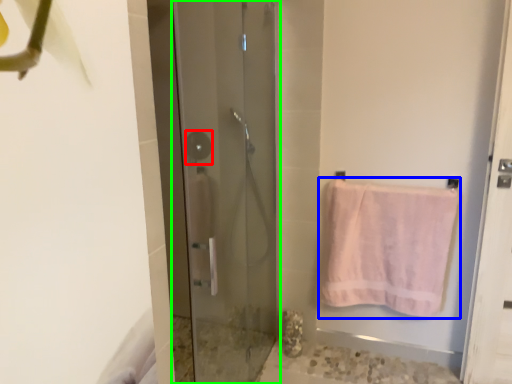
Question: Which object is positioned farthest from shower (highlighted by a red box)? Select from towel (highlighted by a blue box) and door (highlighted by a green box).

Choices:
 (A) towel
 (B) door

Answer: (A)